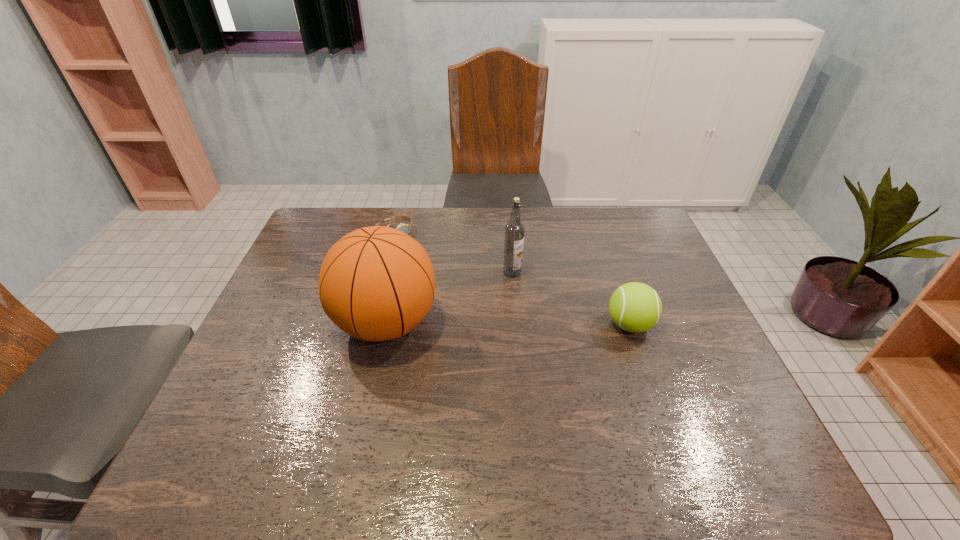
The image size is (960, 540). In order to click on free space at the right edge in this screenshot , I will do `click(643, 250)`.

Identify the location of free space at the far left corner of the desktop. (x=344, y=211).

The width and height of the screenshot is (960, 540). In the image, there is a desktop. In order to click on vacant space at the far right corner in this screenshot , I will do coord(623,248).

The width and height of the screenshot is (960, 540). I want to click on empty space that is in between the third object from left to right and the shortest object, so 453,252.

In order to click on unoccupied area between the tennis ball and the third nearest object in this screenshot , I will do `click(571, 298)`.

Locate an element on the screen. This screenshot has height=540, width=960. free space between the third nearest object and the basketball is located at coordinates (449, 298).

The image size is (960, 540). I want to click on vacant space that is in between the basketball and the third object from left to right, so click(449, 298).

Find the location of a particular element. The image size is (960, 540). empty space between the farthest object and the rightmost object is located at coordinates (512, 279).

Find the location of `vacant space that's between the basketball and the third tallest object`. vacant space that's between the basketball and the third tallest object is located at coordinates (508, 324).

Locate an element on the screen. The width and height of the screenshot is (960, 540). vacant region between the basketball and the second farthest object is located at coordinates (449, 298).